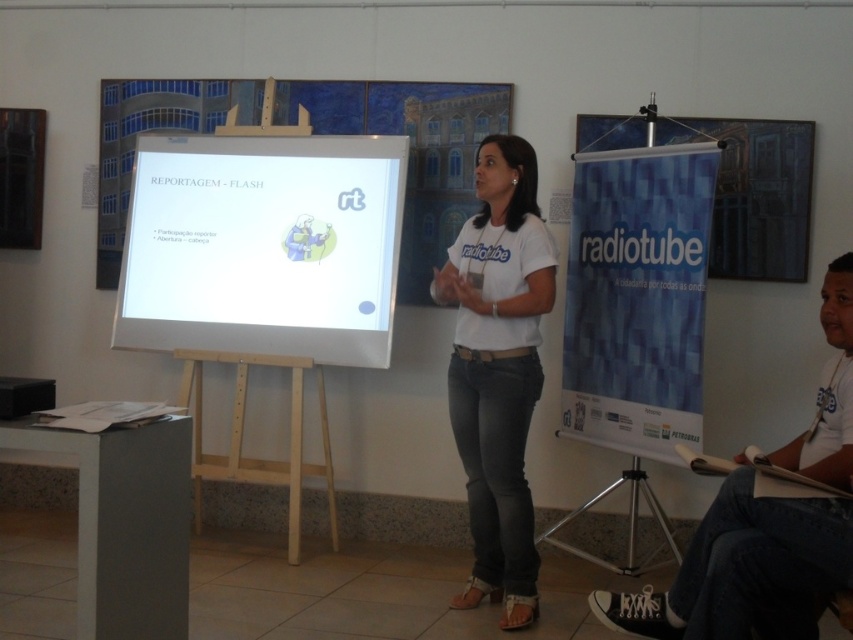
Question: Is white cotton shirt at center positioned behind white t-shirt at center?

Choices:
 (A) no
 (B) yes

Answer: (B)

Question: Is white glossy projection screen at center to the right of white cotton shirt at center from the viewer's perspective?

Choices:
 (A) yes
 (B) no

Answer: (B)

Question: Which of the following is the closest to the observer?

Choices:
 (A) (244, 410)
 (B) (840, 544)

Answer: (B)

Question: Does white cotton shirt at center appear on the left side of white t-shirt at center?

Choices:
 (A) no
 (B) yes

Answer: (B)

Question: Among these points, which one is nearest to the camera?

Choices:
 (A) (328, 436)
 (B) (300, 328)
 (C) (837, 440)

Answer: (C)

Question: Which of the following is the farthest from the observer?

Choices:
 (A) light wood easel at center
 (B) white t-shirt at center
 (C) white glossy projection screen at center
 (D) white cotton shirt at center

Answer: (A)